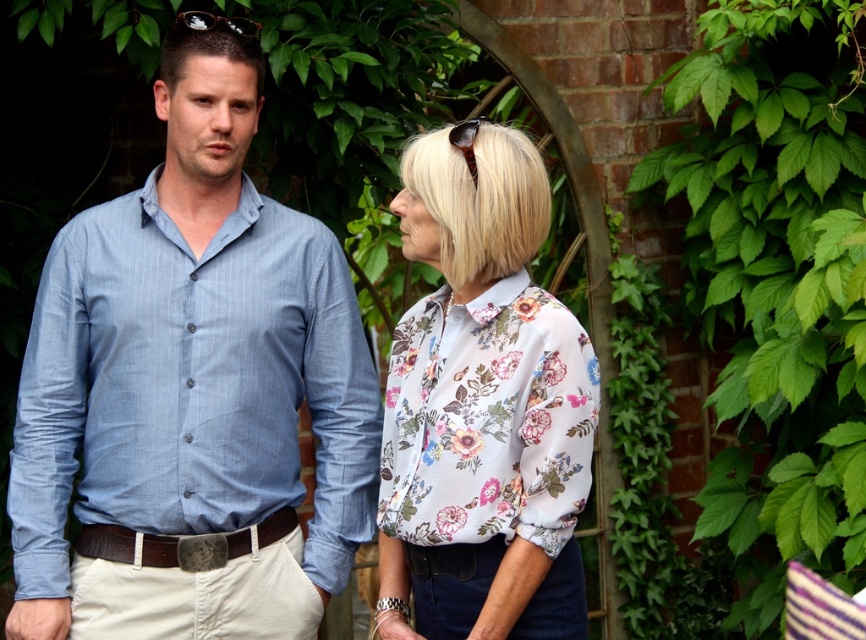
Which is more to the right, floral print blouse at center or brown leather belt at center?

Positioned to the right is floral print blouse at center.

Is point (410, 244) positioned after point (179, 547)?

No, it is in front of (179, 547).

Locate an element on the screen. The width and height of the screenshot is (866, 640). floral print blouse at center is located at coordinates (482, 406).

Does light blue cotton shirt at left appear on the left side of brown leather belt at center?

Correct, you'll find light blue cotton shirt at left to the left of brown leather belt at center.

Find the location of a particular element. Image resolution: width=866 pixels, height=640 pixels. light blue cotton shirt at left is located at coordinates (191, 388).

Is light blue cotton shirt at left positioned at the back of floral print blouse at center?

That is True.

This screenshot has width=866, height=640. Describe the element at coordinates (191, 388) in the screenshot. I see `light blue cotton shirt at left` at that location.

At what (x,y) coordinates should I click in order to perform the action: click on light blue cotton shirt at left. Please return your answer as a coordinate pair (x, y). Looking at the image, I should click on (191, 388).

Where is `light blue cotton shirt at left`? light blue cotton shirt at left is located at coordinates (191, 388).